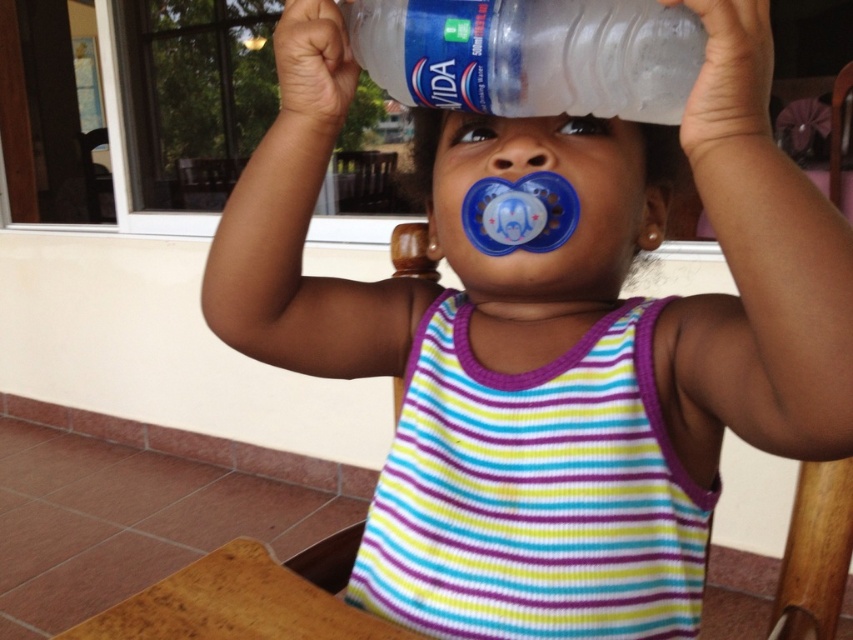
Question: Can you confirm if transparent plastic bottle at center is positioned to the left of matte blue pacifier at center?

Choices:
 (A) no
 (B) yes

Answer: (B)

Question: Can you confirm if transparent plastic bottle at center is positioned below matte blue pacifier at center?

Choices:
 (A) no
 (B) yes

Answer: (A)

Question: Where is transparent plastic bottle at center located in relation to matte blue pacifier at center in the image?

Choices:
 (A) below
 (B) above

Answer: (B)

Question: Among these points, which one is nearest to the camera?

Choices:
 (A) (502, 112)
 (B) (546, 132)

Answer: (A)